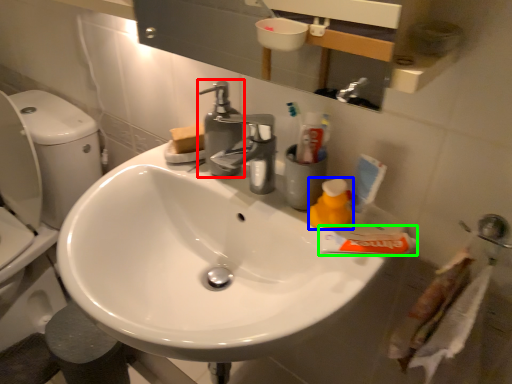
Question: Which object is the farthest from plumbing fixture (highlighted by a red box)? Choose among these: cleaning product (highlighted by a blue box) or toothpaste (highlighted by a green box).

Choices:
 (A) cleaning product
 (B) toothpaste

Answer: (B)